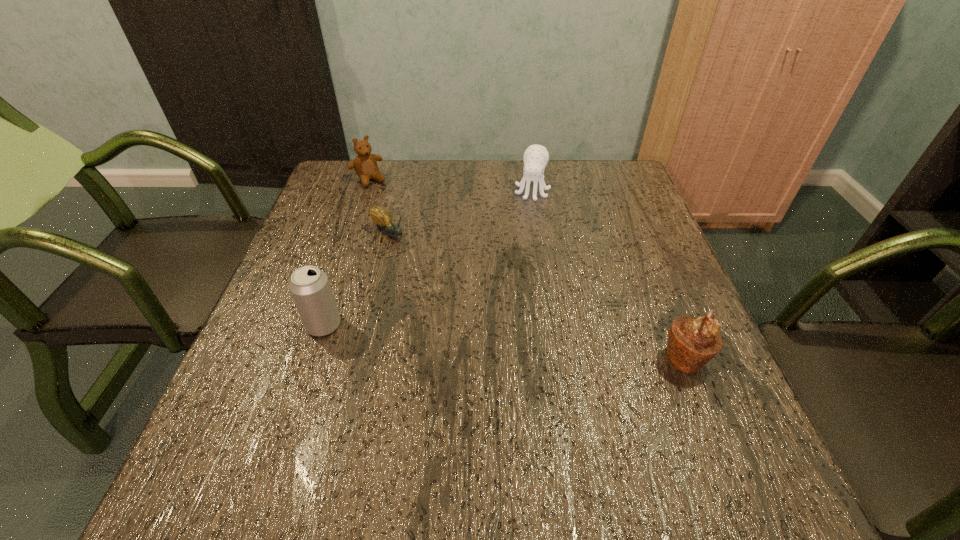
Find the location of a particular element. vacant space at the near right corner is located at coordinates (706, 434).

Image resolution: width=960 pixels, height=540 pixels. What are the coordinates of `free space that is in between the nearest object and the beer can` in the screenshot? It's located at (504, 341).

Identify the location of free space between the shortest object and the muffin. (537, 296).

You are a GUI agent. You are given a task and a screenshot of the screen. Output one action in this format:
    pyautogui.click(x=<x>, y=<y>)
    Task: Click on the vacant point located between the fourth object from left to right and the rightmost object
    
    Given the screenshot: What is the action you would take?
    pyautogui.click(x=609, y=275)

The height and width of the screenshot is (540, 960). What are the coordinates of `vacant space that's between the second nearest object and the rightmost object` in the screenshot? It's located at (504, 341).

The width and height of the screenshot is (960, 540). I want to click on vacant space that's between the nearest object and the fourth farthest object, so click(x=504, y=341).

Image resolution: width=960 pixels, height=540 pixels. I want to click on free point between the fourth object from left to right and the teddy bear, so click(450, 185).

Image resolution: width=960 pixels, height=540 pixels. Identify the location of free area in between the muffin and the beer can. (504, 341).

The width and height of the screenshot is (960, 540). Identify the location of vacant area that lies between the octopus and the beer can. (428, 258).

The width and height of the screenshot is (960, 540). In order to click on free space between the beer can and the teddy bear in this screenshot , I will do `click(347, 252)`.